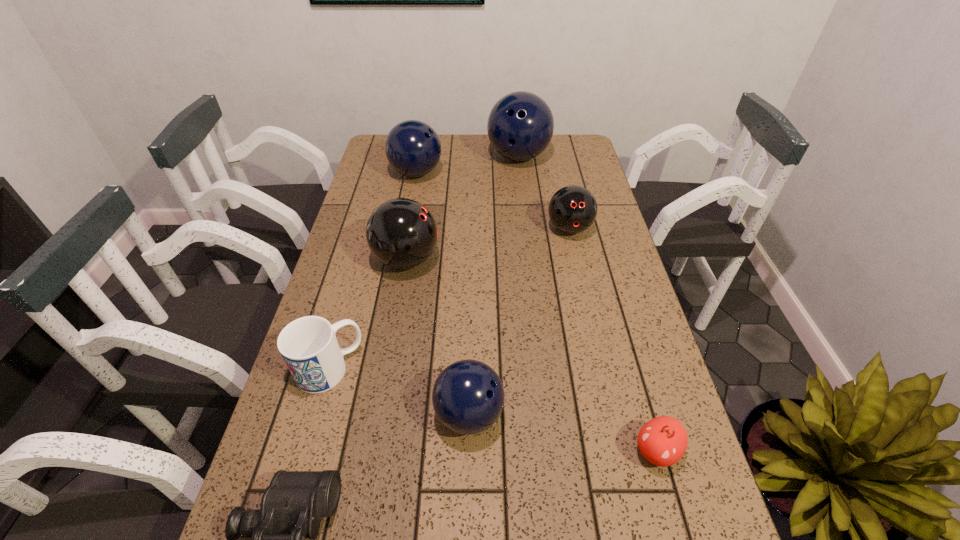
This screenshot has height=540, width=960. Identify the location of vacant area at the far edge of the desktop. (527, 164).

The width and height of the screenshot is (960, 540). In the image, there is a desktop. What are the coordinates of `vacant space at the right edge` in the screenshot? It's located at (636, 458).

This screenshot has height=540, width=960. What are the coordinates of `vacant space that's between the biggest blue bowling ball and the left black bowling ball` in the screenshot? It's located at (463, 208).

Identify the location of free space between the left black bowling ball and the right black bowling ball. (488, 244).

Locate an element on the screen. Image resolution: width=960 pixels, height=540 pixels. vacant area that lies between the blue mug and the second smallest blue bowling ball is located at coordinates (372, 271).

At what (x,y) coordinates should I click in order to perform the action: click on free point between the second biggest blue bowling ball and the tallest bowling ball. Please return your answer as a coordinate pair (x, y). Image resolution: width=960 pixels, height=540 pixels. Looking at the image, I should click on (468, 165).

Identify which object is the fifth closest to the apple. Please provide its 2D coordinates. Your answer should be formatted as a tuple, i.e. [(x, y)], where the tuple contains the x and y coordinates of a point satisfying the conditions above.

[(401, 233)]

Image resolution: width=960 pixels, height=540 pixels. Identify the location of object that stands as the third closest to the red apple. (308, 345).

Locate which bowling ball is the fifth closest to the red apple. Please provide its 2D coordinates. Your answer should be formatted as a tuple, i.e. [(x, y)], where the tuple contains the x and y coordinates of a point satisfying the conditions above.

[(413, 148)]

Identify which bowling ball is the fifth closest to the black binoculars. Please provide its 2D coordinates. Your answer should be formatted as a tuple, i.e. [(x, y)], where the tuple contains the x and y coordinates of a point satisfying the conditions above.

[(520, 126)]